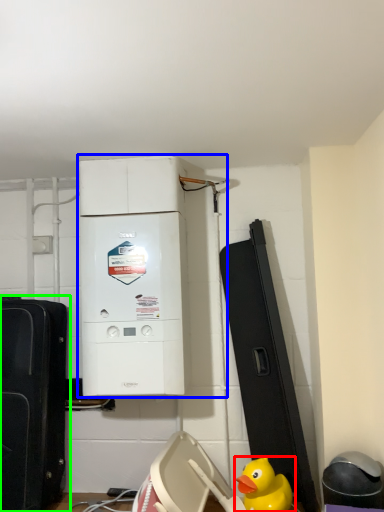
Question: Which object is positioned closest to duck (highlighted by a red box)? Select from home appliance (highlighted by a blue box) and toy (highlighted by a green box).

Choices:
 (A) home appliance
 (B) toy

Answer: (A)